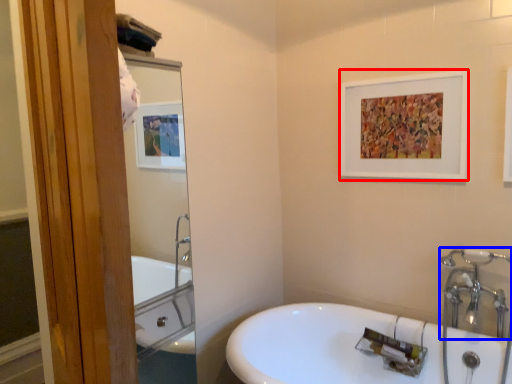
Question: Which object appears farthest to the camera in this image, picture frame (highlighted by a red box) or plumbing fixture (highlighted by a blue box)?

Choices:
 (A) picture frame
 (B) plumbing fixture

Answer: (A)